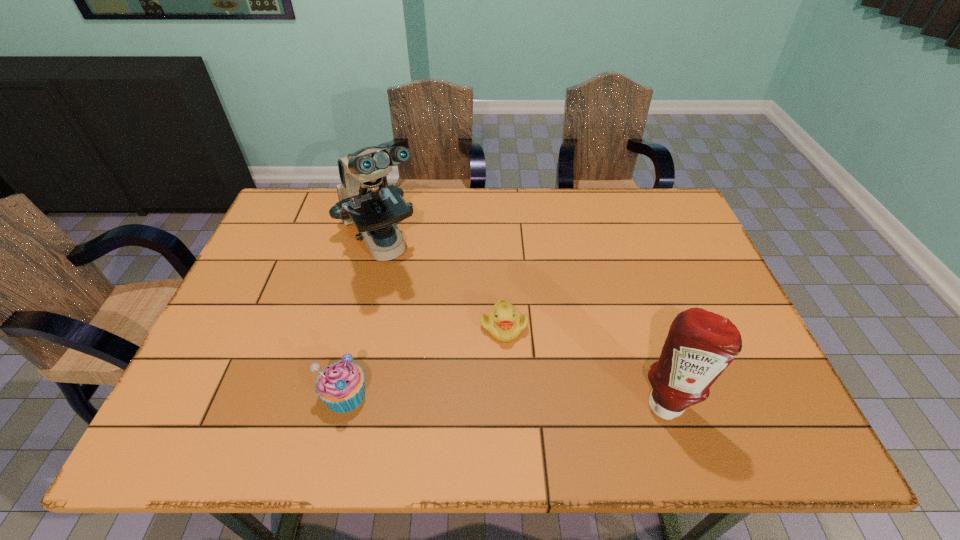
Identify the location of the third tallest object. 340,385.

This screenshot has height=540, width=960. What are the coordinates of `the second tallest object` in the screenshot? It's located at (700, 345).

Where is `the rightmost object`? the rightmost object is located at coordinates (700, 345).

At what (x,y) coordinates should I click in order to perform the action: click on the tallest object. Please return your answer as a coordinate pair (x, y). The height and width of the screenshot is (540, 960). Looking at the image, I should click on (374, 210).

Locate an element on the screen. the farthest object is located at coordinates (374, 210).

Where is `the shortest object`? the shortest object is located at coordinates (504, 322).

In order to click on the third object from left to right in this screenshot , I will do `click(504, 322)`.

The width and height of the screenshot is (960, 540). I want to click on free space located 0.250m on the right of the muffin, so click(x=482, y=394).

Find the location of a particular element. The image size is (960, 540). free space located on the left of the third shortest object is located at coordinates (547, 401).

This screenshot has width=960, height=540. I want to click on free space located 0.060m through the eyepieces of the farthest object, so click(x=406, y=296).